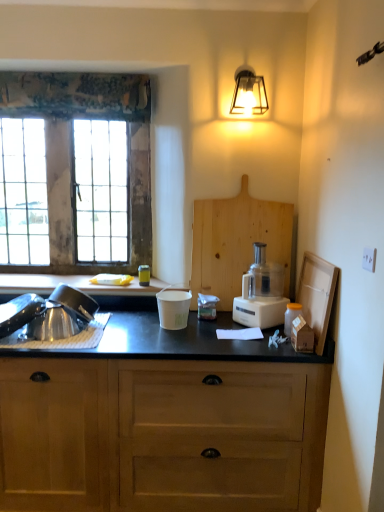
Question: Could black matte countertop at left be considered to be inside wooden window at left?

Choices:
 (A) yes
 (B) no

Answer: (B)

Question: Is wooden window at left touching black matte countertop at left?

Choices:
 (A) no
 (B) yes

Answer: (A)

Question: Is wooden window at left aimed at black matte countertop at left?

Choices:
 (A) no
 (B) yes

Answer: (B)

Question: Can you confirm if wooden window at left is taller than black matte countertop at left?

Choices:
 (A) no
 (B) yes

Answer: (B)

Question: Does wooden window at left have a greater width compared to black matte countertop at left?

Choices:
 (A) no
 (B) yes

Answer: (A)

Question: Is wooden window at left at the left side of black matte countertop at left?

Choices:
 (A) yes
 (B) no

Answer: (A)

Question: Is brushed metal sink at lower left aimed at metallic lantern at upper right?

Choices:
 (A) no
 (B) yes

Answer: (A)

Question: Is brushed metal sink at lower left at the left side of metallic lantern at upper right?

Choices:
 (A) no
 (B) yes

Answer: (B)

Question: Does brushed metal sink at lower left have a smaller size compared to metallic lantern at upper right?

Choices:
 (A) no
 (B) yes

Answer: (B)

Question: Is brushed metal sink at lower left located outside metallic lantern at upper right?

Choices:
 (A) yes
 (B) no

Answer: (A)

Question: Considering the relative sizes of brushed metal sink at lower left and metallic lantern at upper right in the image provided, is brushed metal sink at lower left taller than metallic lantern at upper right?

Choices:
 (A) no
 (B) yes

Answer: (A)

Question: Would you say brushed metal sink at lower left is a long distance from metallic lantern at upper right?

Choices:
 (A) yes
 (B) no

Answer: (A)

Question: Is white plastic food processor at center-right closer to the viewer compared to wooden cabinet at lower center?

Choices:
 (A) yes
 (B) no

Answer: (B)